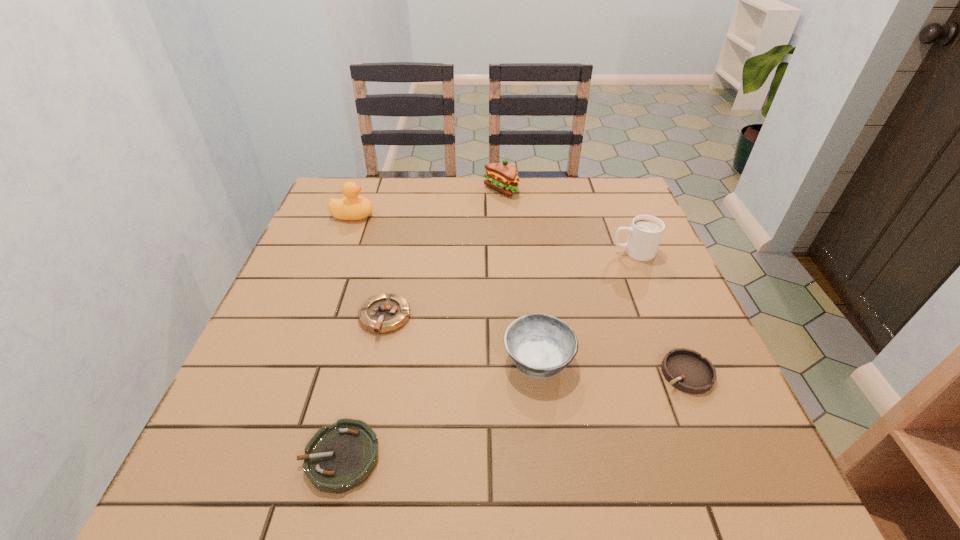
In the image, there is a desktop. Identify the location of vacant space at the near left corner. The height and width of the screenshot is (540, 960). (252, 462).

Identify the location of blank space at the far right corner of the desktop. The width and height of the screenshot is (960, 540). (599, 204).

You are a GUI agent. You are given a task and a screenshot of the screen. Output one action in this format:
    pyautogui.click(x=<x>, y=<y>)
    Task: Click on the vacant area at the near right corner
    
    Given the screenshot: What is the action you would take?
    pyautogui.click(x=682, y=505)

This screenshot has height=540, width=960. Identify the location of free space between the rightmost ashtray and the nearest ashtray. [x=514, y=415].

This screenshot has height=540, width=960. I want to click on free space between the nearest object and the duck, so click(347, 336).

Find the location of a particular element. This screenshot has width=960, height=540. free spot between the shortest object and the leftmost object is located at coordinates (347, 336).

In order to click on empty space between the leftmost object and the rightmost ashtray in this screenshot , I will do `click(519, 294)`.

Locate an element on the screen. vacant point located between the rightmost ashtray and the shortest object is located at coordinates (514, 415).

I want to click on free space between the cappuccino and the tallest ashtray, so click(x=586, y=306).

This screenshot has width=960, height=540. What are the coordinates of `object identified as the fourth closest to the fifth shortest object` in the screenshot? It's located at (383, 313).